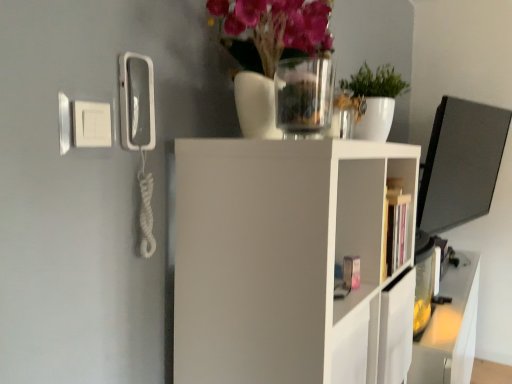
Question: Is matte plastic cabinet at center spatially inside transparent glass vase at upper center, or outside of it?

Choices:
 (A) inside
 (B) outside

Answer: (B)

Question: From the image's perspective, is matte plastic cabinet at center positioned above or below transparent glass vase at upper center?

Choices:
 (A) above
 (B) below

Answer: (B)

Question: Which object is the farthest from the white matte shelf at center?

Choices:
 (A) green matte plant at upper center
 (B) transparent glass vase at upper center
 (C) translucent glass vase at upper center
 (D) matte plastic cabinet at center

Answer: (A)

Question: Estimate the real-world distances between objects in this image. Which object is closer to the translucent glass vase at upper center?

Choices:
 (A) green matte plant at upper center
 (B) matte plastic cabinet at center
 (C) white matte shelf at center
 (D) transparent glass vase at upper center

Answer: (D)